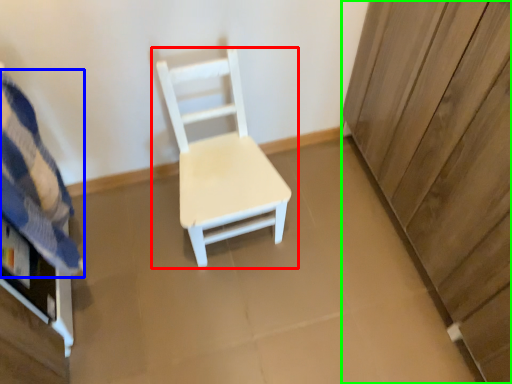
Question: Considering the real-world distances, which object is farthest from chair (highlighted by a red box)? bedding (highlighted by a blue box) or dresser (highlighted by a green box)?

Choices:
 (A) bedding
 (B) dresser

Answer: (B)